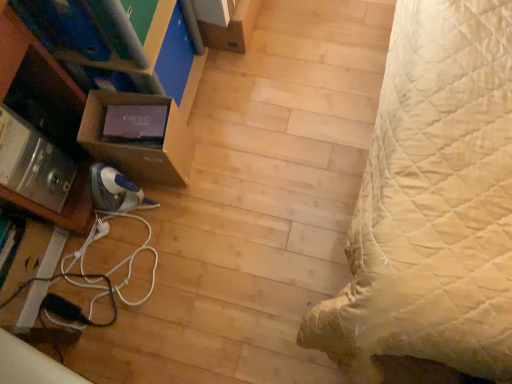
Identify the location of free spot in front of brown cardboard box at left, the 2th shelf positioned from the left. Image resolution: width=512 pixels, height=384 pixels. (185, 206).